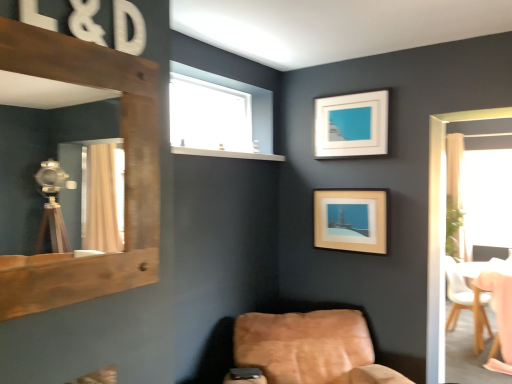
Question: Does leather at lower right, acting as the 1th chair starting from the front, have a greater height compared to white matte picture frame at upper center, which ranks as the second picture frame in bottom-to-top order?

Choices:
 (A) yes
 (B) no

Answer: (A)

Question: Is the surface of leather at lower right, which is the 3th chair in right-to-left order, in direct contact with white matte picture frame at upper center, which ranks as the second picture frame in bottom-to-top order?

Choices:
 (A) yes
 (B) no

Answer: (B)

Question: From a real-world perspective, is leather at lower right, which is the 3th chair in right-to-left order, located beneath white matte picture frame at upper center, which ranks as the second picture frame in bottom-to-top order?

Choices:
 (A) yes
 (B) no

Answer: (A)

Question: Considering the relative sizes of leather at lower right, which is the 3th chair in right-to-left order, and white matte picture frame at upper center, which ranks as the second picture frame in bottom-to-top order, in the image provided, is leather at lower right, which is the 3th chair in right-to-left order, thinner than white matte picture frame at upper center, which ranks as the second picture frame in bottom-to-top order,?

Choices:
 (A) no
 (B) yes

Answer: (A)

Question: Is leather at lower right, marked as the 1th chair in a left-to-right arrangement, facing towards white matte picture frame at upper center, placed as the 1th picture frame when sorted from top to bottom?

Choices:
 (A) no
 (B) yes

Answer: (A)

Question: From the image's perspective, is leather at lower right, which is the 3th chair in right-to-left order, on top of white matte picture frame at upper center, placed as the 1th picture frame when sorted from top to bottom?

Choices:
 (A) no
 (B) yes

Answer: (A)

Question: Can you confirm if white leather chair at right, the second chair positioned from the right, is wider than rustic wood mirror at left?

Choices:
 (A) no
 (B) yes

Answer: (B)

Question: Can you confirm if white leather chair at right, which is the 3th chair from front to back, is smaller than rustic wood mirror at left?

Choices:
 (A) no
 (B) yes

Answer: (A)

Question: Is white leather chair at right, the first chair viewed from the back, facing away from rustic wood mirror at left?

Choices:
 (A) no
 (B) yes

Answer: (A)

Question: Is white leather chair at right, the second chair positioned from the right, in contact with rustic wood mirror at left?

Choices:
 (A) yes
 (B) no

Answer: (B)

Question: Is white leather chair at right, the first chair viewed from the back, to the right of rustic wood mirror at left from the viewer's perspective?

Choices:
 (A) no
 (B) yes

Answer: (B)

Question: Can you confirm if transparent glass window at upper center is shorter than wooden chair at lower right, which is the 1th chair in right-to-left order?

Choices:
 (A) no
 (B) yes

Answer: (B)